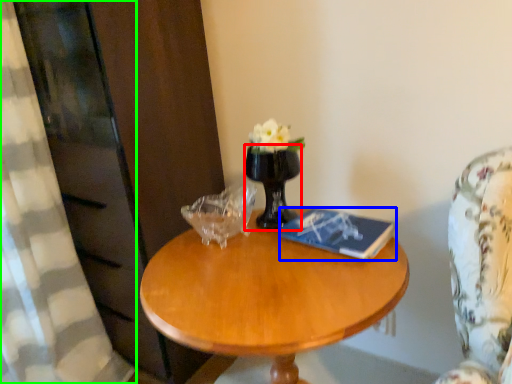
Question: Which is farther away from vase (highlighted by a red box)? book (highlighted by a blue box) or curtain (highlighted by a green box)?

Choices:
 (A) book
 (B) curtain

Answer: (B)